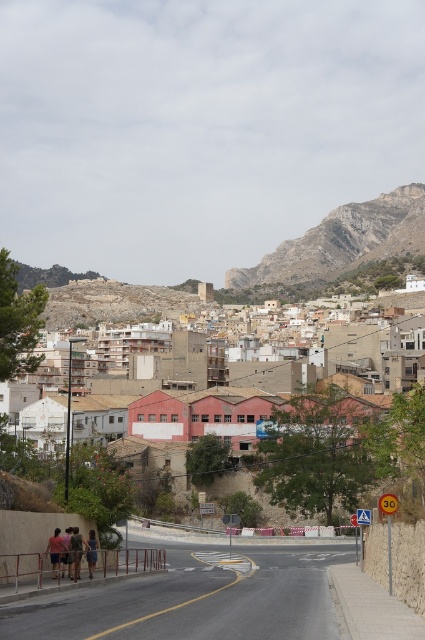
Question: Is beige stone buildings at center wider than dark brown leather jacket at lower left?

Choices:
 (A) no
 (B) yes

Answer: (B)

Question: In this image, where is dark brown leather jacket at lower left located relative to denim shorts at lower left?

Choices:
 (A) right
 (B) left

Answer: (B)

Question: Which object appears closest to the camera in this image?

Choices:
 (A) matte gray shirt at lower left
 (B) light brown leather jacket at lower left
 (C) beige stone buildings at center
 (D) rugged stone mountain at upper right

Answer: (C)

Question: Which point is closer to the camera taking this photo?

Choices:
 (A) (70, 525)
 (B) (291, 262)
 (C) (53, 561)

Answer: (C)

Question: Is beige stone buildings at center positioned at the back of denim shorts at lower left?

Choices:
 (A) yes
 (B) no

Answer: (B)

Question: Which object is closer to the camera taking this photo?

Choices:
 (A) light brown leather jacket at lower left
 (B) beige stone buildings at center
 (C) rugged stone mountain at upper right

Answer: (B)